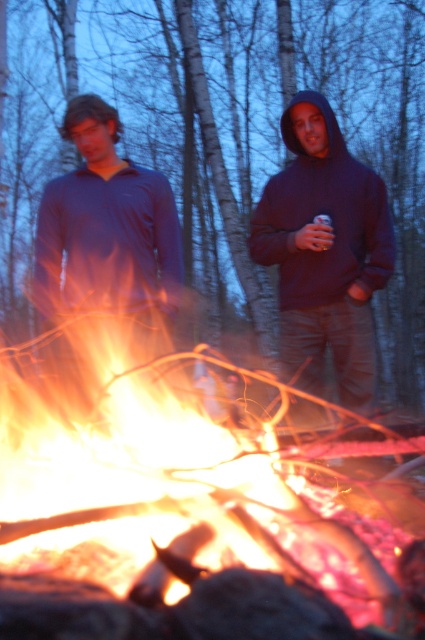
Question: Is the position of flaming wood at center less distant than that of matte blue hoodie at center?

Choices:
 (A) yes
 (B) no

Answer: (A)

Question: Which of the following is the farthest from the observer?

Choices:
 (A) dark blue hoodie at center
 (B) matte blue hoodie at center
 (C) matte blue shirt at left

Answer: (A)

Question: Which point is farther to the camera?

Choices:
 (A) matte blue shirt at left
 (B) metallic can at center
 (C) flaming wood at center
 (D) matte blue hoodie at center

Answer: (B)

Question: Is the position of matte blue hoodie at center more distant than that of dark blue hoodie at center?

Choices:
 (A) yes
 (B) no

Answer: (B)

Question: Which point appears closest to the camera in this image?

Choices:
 (A) (345, 378)
 (B) (164, 202)

Answer: (B)

Question: Is dark blue hoodie at center bigger than metallic can at center?

Choices:
 (A) no
 (B) yes

Answer: (B)